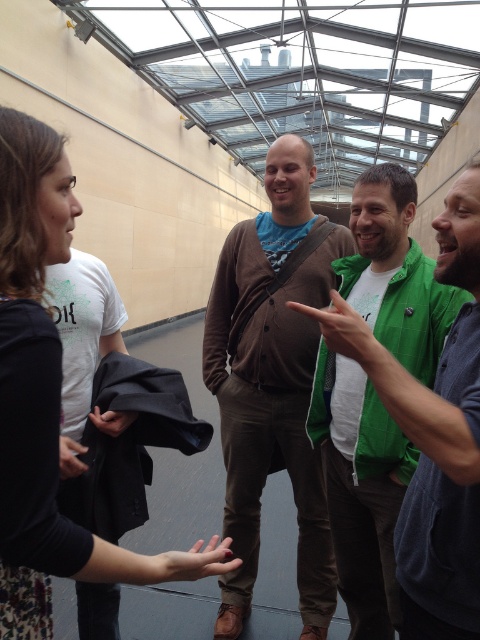
Question: Considering the real-world distances, which object is farthest from the green fabric jacket at center?

Choices:
 (A) smooth skin hand at center
 (B) brown cardigan at center
 (C) black fabric at center

Answer: (C)

Question: Estimate the real-world distances between objects in this image. Which object is farther from the smooth skin hand at center?

Choices:
 (A) black fabric at center
 (B) green fabric jacket at center

Answer: (B)

Question: Does smooth skin hand at center have a lesser width compared to black fabric at center?

Choices:
 (A) no
 (B) yes

Answer: (A)

Question: Based on their relative distances, which object is farther from the smooth skin hand at center?

Choices:
 (A) black fabric at center
 (B) floral dress at left
 (C) black fabric at lower left

Answer: (A)

Question: Does green mesh glove at center appear over black fabric at center?

Choices:
 (A) no
 (B) yes

Answer: (B)

Question: Does black fabric at lower left appear over black fabric at center?

Choices:
 (A) no
 (B) yes

Answer: (A)